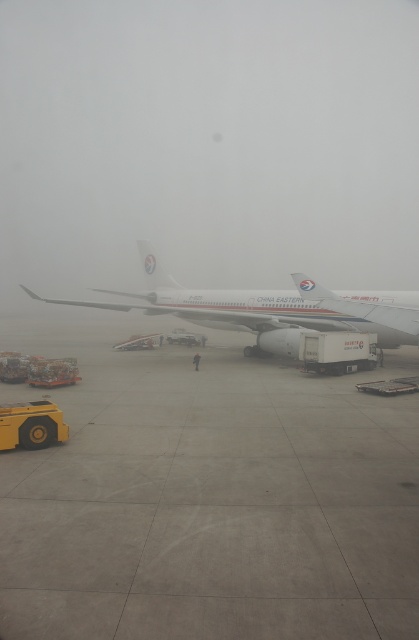
Question: Which object appears farthest from the camera in this image?

Choices:
 (A) gray concrete runway at center
 (B) white matte airplane at center

Answer: (B)

Question: Among these points, which one is nearest to the camera?

Choices:
 (A) (183, 296)
 (B) (375, 496)

Answer: (B)

Question: Which point is farther to the camera?

Choices:
 (A) gray concrete runway at center
 (B) white matte airplane at center

Answer: (B)

Question: Considering the relative positions of gray concrete runway at center and white matte airplane at center in the image provided, where is gray concrete runway at center located with respect to white matte airplane at center?

Choices:
 (A) above
 (B) below

Answer: (B)

Question: Can you confirm if gray concrete runway at center is smaller than white matte airplane at center?

Choices:
 (A) no
 (B) yes

Answer: (B)

Question: Is gray concrete runway at center behind white matte airplane at center?

Choices:
 (A) no
 (B) yes

Answer: (A)